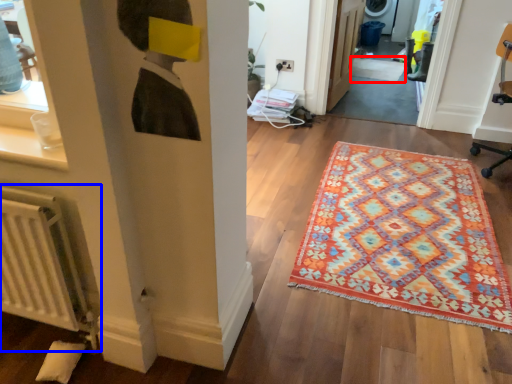
Question: Which object is further to the camera taking this photo, doormat (highlighted by a red box) or radiator (highlighted by a blue box)?

Choices:
 (A) doormat
 (B) radiator

Answer: (A)